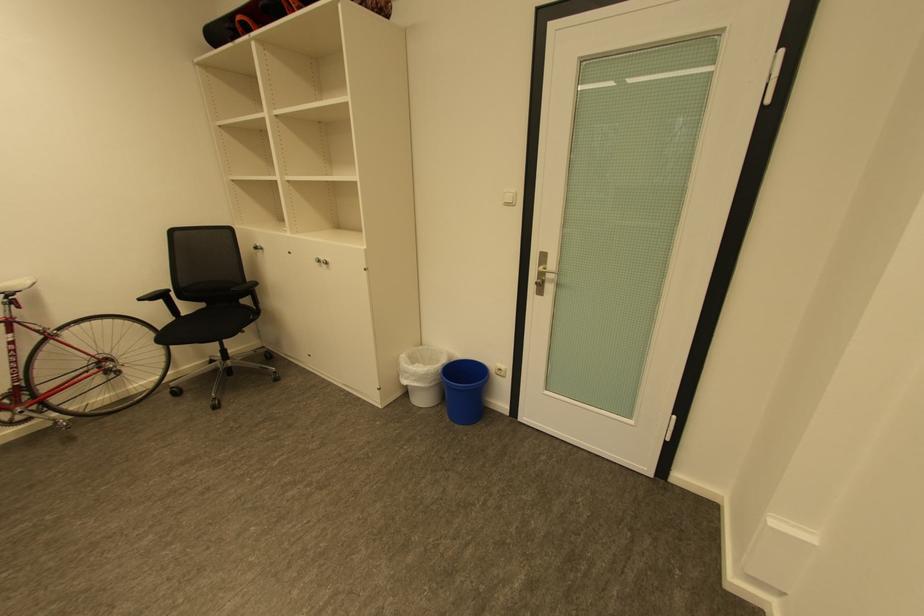
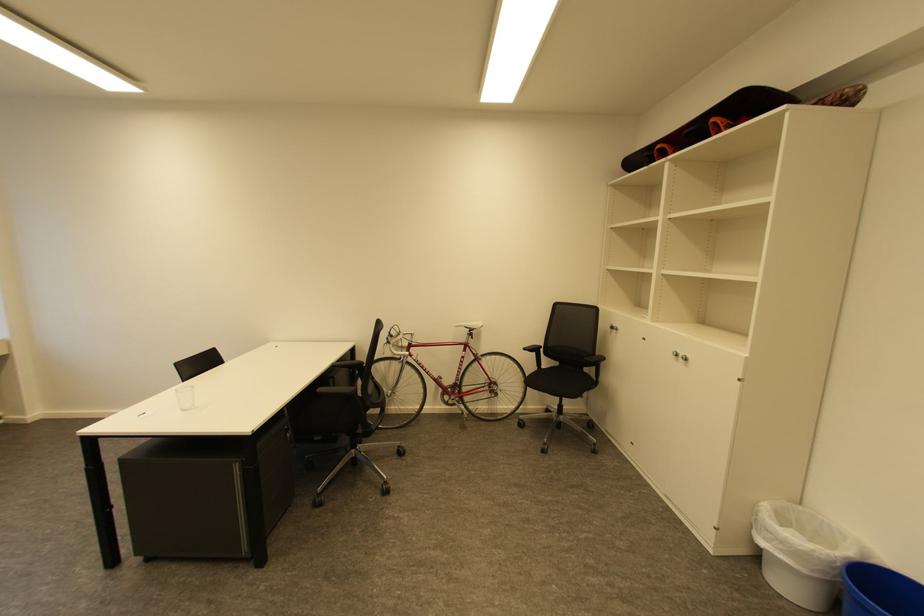
In the second image, find the point that corresponds to point 148,300 in the first image.

(531, 350)